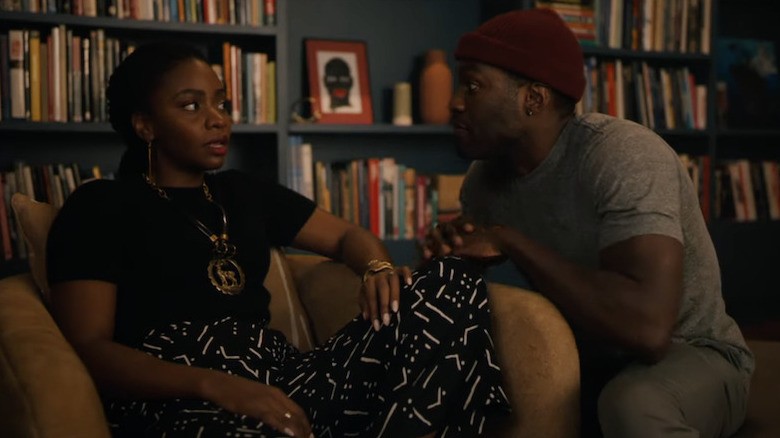
Locate an element on the screen. The image size is (780, 438). frame is located at coordinates (327, 70).